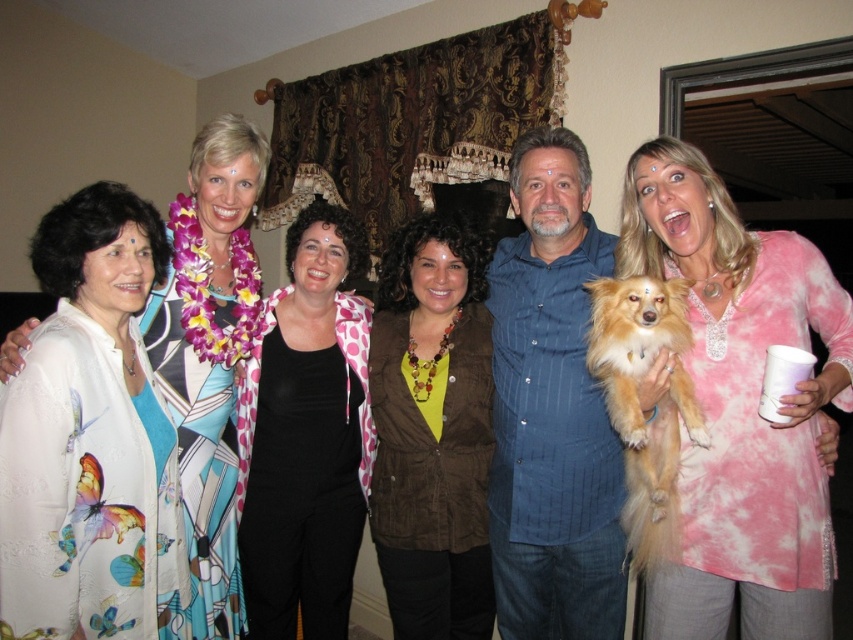
Question: Is printed silk blouse at left above golden fur dog at right?

Choices:
 (A) yes
 (B) no

Answer: (A)

Question: Is printed silk blouse at left thinner than golden fur dog at right?

Choices:
 (A) yes
 (B) no

Answer: (B)

Question: Considering the real-world distances, which object is closest to the golden fur dog at right?

Choices:
 (A) brown corduroy vest at center
 (B) pink tie-dye shirt at center
 (C) black polka dot jacket at center
 (D) printed silk blouse at left

Answer: (B)

Question: Considering the relative positions of pink tie-dye shirt at center and golden fur dog at right in the image provided, where is pink tie-dye shirt at center located with respect to golden fur dog at right?

Choices:
 (A) above
 (B) below

Answer: (A)

Question: Considering the real-world distances, which object is closest to the golden fur dog at right?

Choices:
 (A) pink tie-dye shirt at center
 (B) printed silk blouse at left
 (C) brown corduroy vest at center
 (D) black polka dot jacket at center

Answer: (A)

Question: Among these points, which one is farthest from the camera?

Choices:
 (A) (635, 282)
 (B) (392, 385)

Answer: (B)